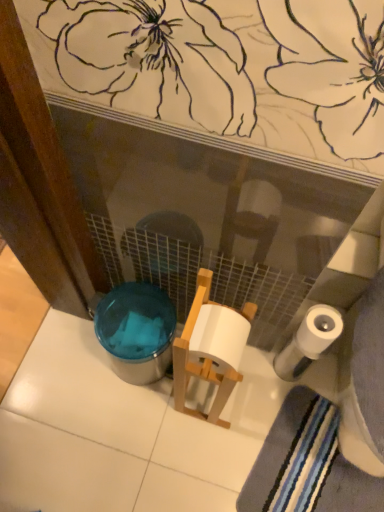
Describe the element at coordinates (137, 331) in the screenshot. The width and height of the screenshot is (384, 512). I see `translucent plastic potty at lower left` at that location.

Measure the distance between translucent plastic potty at lower left and camera.

translucent plastic potty at lower left and camera are 3.36 feet apart from each other.

Where is `white matte toilet paper at lower right`? white matte toilet paper at lower right is located at coordinates (318, 331).

Where is `striped cotton bath towel at lower right`? striped cotton bath towel at lower right is located at coordinates (274, 450).

Find the location of a particular element. toilet paper on the left of the striped cotton bath towel at lower right is located at coordinates (318, 331).

In terms of width, does striped cotton bath towel at lower right look wider or thinner when compared to white matte toilet paper at lower right?

In the image, striped cotton bath towel at lower right appears to be wider than white matte toilet paper at lower right.

Who is smaller, striped cotton bath towel at lower right or white matte toilet paper at lower right?

white matte toilet paper at lower right is smaller.

How different are the orientations of white matte toilet paper at lower right and translucent plastic potty at lower left in degrees?

The angle between the facing direction of white matte toilet paper at lower right and the facing direction of translucent plastic potty at lower left is 0.00261 degrees.

From the image's perspective, would you say white matte toilet paper at lower right is positioned over translucent plastic potty at lower left?

Yes, from the image's perspective, white matte toilet paper at lower right is above translucent plastic potty at lower left.

Which is behind, white matte toilet paper at lower right or translucent plastic potty at lower left?

translucent plastic potty at lower left is further from the camera.

Is white matte toilet paper at lower right to the left or to the right of translucent plastic potty at lower left in the image?

In the image, white matte toilet paper at lower right appears on the right side of translucent plastic potty at lower left.

From a real-world perspective, is translucent plastic potty at lower left positioned over striped cotton bath towel at lower right based on gravity?

Yes, from a real-world perspective, translucent plastic potty at lower left is over striped cotton bath towel at lower right

Considering the sizes of translucent plastic potty at lower left and striped cotton bath towel at lower right in the image, is translucent plastic potty at lower left taller or shorter than striped cotton bath towel at lower right?

In the image, translucent plastic potty at lower left appears to be taller than striped cotton bath towel at lower right.

Considering the relative sizes of translucent plastic potty at lower left and striped cotton bath towel at lower right in the image provided, is translucent plastic potty at lower left bigger than striped cotton bath towel at lower right?

Correct, translucent plastic potty at lower left is larger in size than striped cotton bath towel at lower right.

From the image's perspective, which is above, translucent plastic potty at lower left or striped cotton bath towel at lower right?

translucent plastic potty at lower left.

Is white matte toilet paper at lower right not near striped cotton bath towel at lower right?

No, there isn't a large distance between white matte toilet paper at lower right and striped cotton bath towel at lower right.

From a real-world perspective, which object stands above the other?

white matte toilet paper at lower right.

Does white matte toilet paper at lower right lie behind striped cotton bath towel at lower right?

No, it is in front of striped cotton bath towel at lower right.

From the image's perspective, who appears lower, striped cotton bath towel at lower right or translucent plastic potty at lower left?

striped cotton bath towel at lower right appears lower in the image.

Considering the sizes of objects striped cotton bath towel at lower right and translucent plastic potty at lower left in the image provided, who is taller, striped cotton bath towel at lower right or translucent plastic potty at lower left?

With more height is translucent plastic potty at lower left.

From the picture: From a real-world perspective, relative to translucent plastic potty at lower left, is striped cotton bath towel at lower right vertically above or below?

striped cotton bath towel at lower right is situated lower than translucent plastic potty at lower left in the real world.

How many degrees apart are the facing directions of striped cotton bath towel at lower right and translucent plastic potty at lower left?

17 degrees.

Is the surface of translucent plastic potty at lower left in direct contact with white matte toilet paper at lower right?

translucent plastic potty at lower left and white matte toilet paper at lower right are clearly separated.

Is translucent plastic potty at lower left further to the viewer compared to white matte toilet paper at lower right?

Yes, it is.

Based on the photo, from a real-world perspective, is translucent plastic potty at lower left over white matte toilet paper at lower right?

No.

Is point (165, 353) positioned before point (315, 347)?

No, (165, 353) is behind (315, 347).

In the image, there is a striped cotton bath towel at lower right. Where is `toilet paper above it (from the image's perspective)`? The width and height of the screenshot is (384, 512). toilet paper above it (from the image's perspective) is located at coordinates (318, 331).

This screenshot has width=384, height=512. In the image, there is a white matte toilet paper at lower right. Identify the location of potty below it (from a real-world perspective). (137, 331).

Considering their positions, is striped cotton bath towel at lower right positioned further to translucent plastic potty at lower left than white matte toilet paper at lower right?

striped cotton bath towel at lower right.

Based on their spatial positions, is striped cotton bath towel at lower right or translucent plastic potty at lower left further from white matte toilet paper at lower right?

translucent plastic potty at lower left is further to white matte toilet paper at lower right.

Based on their spatial positions, is translucent plastic potty at lower left or white matte toilet paper at lower right further from striped cotton bath towel at lower right?

translucent plastic potty at lower left.

Estimate the real-world distances between objects in this image. Which object is further from translucent plastic potty at lower left, white matte toilet paper at lower right or striped cotton bath towel at lower right?

striped cotton bath towel at lower right.

When comparing their distances from white matte toilet paper at lower right, does translucent plastic potty at lower left or striped cotton bath towel at lower right seem closer?

Based on the image, striped cotton bath towel at lower right appears to be nearer to white matte toilet paper at lower right.

Looking at the image, which one is located closer to striped cotton bath towel at lower right, white matte toilet paper at lower right or translucent plastic potty at lower left?

white matte toilet paper at lower right is closer to striped cotton bath towel at lower right.

At what (x,y) coordinates should I click in order to perform the action: click on toilet paper between translucent plastic potty at lower left and striped cotton bath towel at lower right from left to right. Please return your answer as a coordinate pair (x, y). This screenshot has height=512, width=384. Looking at the image, I should click on coord(318,331).